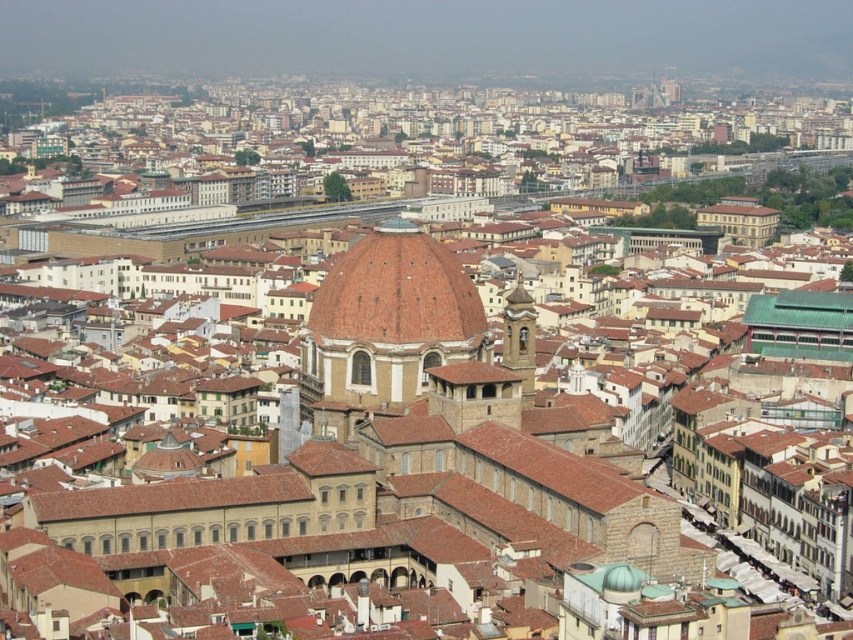
Question: Does brown matte dome at center appear on the left side of smooth stone bell tower at center-right?

Choices:
 (A) no
 (B) yes

Answer: (B)

Question: Can you confirm if brown matte dome at center is bigger than smooth stone bell tower at center-right?

Choices:
 (A) no
 (B) yes

Answer: (A)

Question: Can you confirm if brown matte dome at center is bigger than smooth stone bell tower at center-right?

Choices:
 (A) yes
 (B) no

Answer: (B)